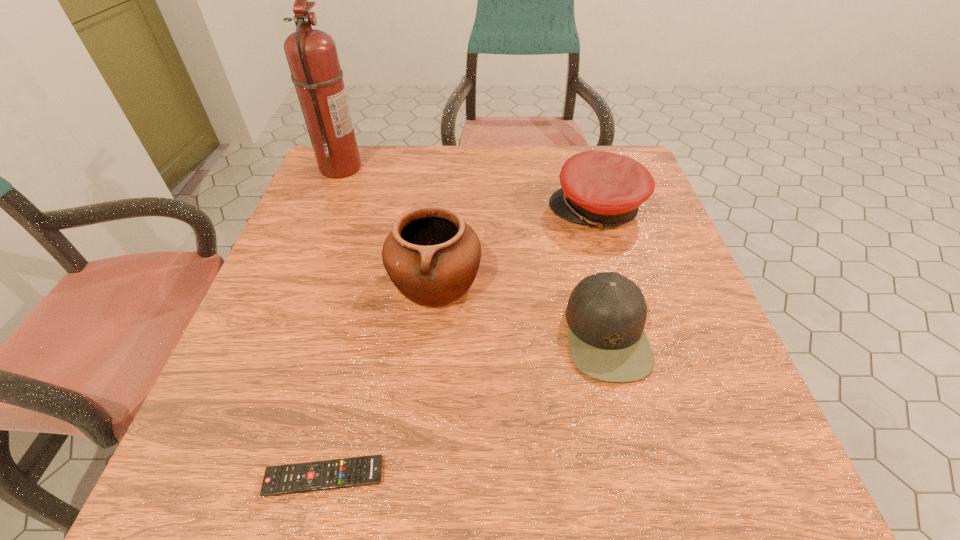
Image resolution: width=960 pixels, height=540 pixels. What are the coordinates of `free space between the nearer cap and the farther cap` in the screenshot? It's located at (602, 272).

I want to click on free space between the fourth nearest object and the nearer cap, so click(x=602, y=272).

Identify the location of empty space between the second farthest object and the pottery. (516, 245).

In order to click on unoccupied area between the nearer cap and the fourth nearest object in this screenshot , I will do `click(602, 272)`.

This screenshot has height=540, width=960. I want to click on free space between the pottery and the fire extinguisher, so click(x=388, y=224).

What are the coordinates of `vacant point located between the nearest object and the fourth nearest object` in the screenshot? It's located at point(461,343).

At what (x,y) coordinates should I click in order to perform the action: click on the fourth closest object to the farther cap. Please return your answer as a coordinate pair (x, y). Looking at the image, I should click on (339, 473).

At what (x,y) coordinates should I click in order to perform the action: click on the second closest object relative to the farthest object. Please return your answer as a coordinate pair (x, y). The width and height of the screenshot is (960, 540). Looking at the image, I should click on (603, 189).

The height and width of the screenshot is (540, 960). What are the coordinates of `vacant space that satisfies the following two spatial constraints: 1. on the back side of the shortest object; 2. on the right side of the second tallest object` in the screenshot? It's located at (371, 281).

Image resolution: width=960 pixels, height=540 pixels. I want to click on vacant space that satisfies the following two spatial constraints: 1. on the back side of the remote control; 2. on the right side of the fourth shortest object, so click(371, 281).